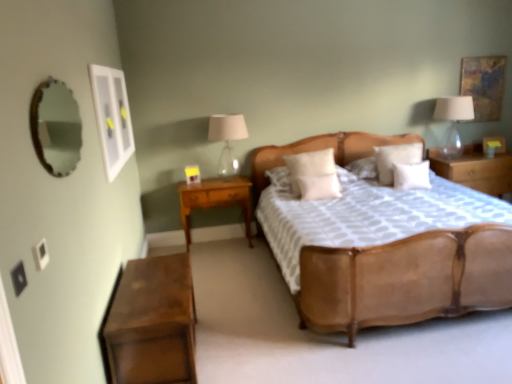
Question: Is textured canvas painting at upper right, marked as the first picture frame in a top-to-bottom arrangement, to the left or to the right of white soft pillow at center, which ranks as the 1th pillow in left-to-right order, in the image?

Choices:
 (A) left
 (B) right

Answer: (B)

Question: Is point (496, 84) positioned closer to the camera than point (304, 188)?

Choices:
 (A) farther
 (B) closer

Answer: (A)

Question: Which object is positioned closest to the textured canvas painting at upper right, the 2th picture frame from the front?

Choices:
 (A) translucent glass lampshade at right, which is counted as the 1th bedside lamp, starting from the right
 (B) matte glass lampshade at center, the first bedside lamp viewed from the left
 (C) white soft pillow at center, placed as the 3th pillow when sorted from left to right
 (D) wooden nightstand at right, the third nightstand when ordered from front to back
 (E) white soft pillow at center, the 4th pillow when ordered from left to right

Answer: (A)

Question: Which is farther from the white glossy picture frame at upper left, which is the 1th picture frame from bottom to top?

Choices:
 (A) matte glass lampshade at center, the second bedside lamp in the right-to-left sequence
 (B) textured canvas painting at upper right, the 2th picture frame from the front
 (C) white soft pillow at center, arranged as the 2th pillow when viewed from the left
 (D) leather bed at center
 (E) light wood/wooden nightstand at lower left, the second nightstand when ordered from right to left

Answer: (B)